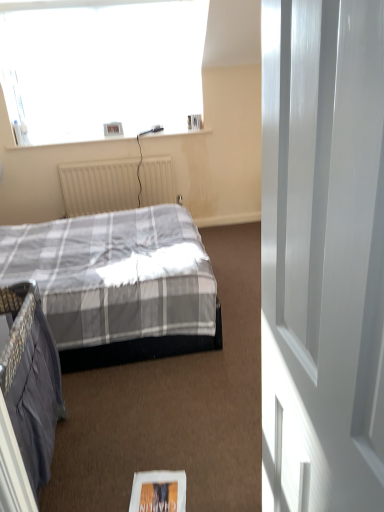
Question: Can you confirm if beige textured radiator at center is wider than white glossy door at right?

Choices:
 (A) no
 (B) yes

Answer: (B)

Question: Considering the relative positions of beige textured radiator at center and white glossy door at right in the image provided, is beige textured radiator at center to the left of white glossy door at right from the viewer's perspective?

Choices:
 (A) no
 (B) yes

Answer: (B)

Question: Does beige textured radiator at center have a smaller size compared to white glossy door at right?

Choices:
 (A) no
 (B) yes

Answer: (A)

Question: Is beige textured radiator at center positioned behind white glossy door at right?

Choices:
 (A) no
 (B) yes

Answer: (B)

Question: Is beige textured radiator at center far away from white glossy door at right?

Choices:
 (A) yes
 (B) no

Answer: (A)

Question: From the image's perspective, relative to white paper magazine at lower center, is beige textured radiator at center above or below?

Choices:
 (A) above
 (B) below

Answer: (A)

Question: In the image, is beige textured radiator at center on the left side or the right side of white paper magazine at lower center?

Choices:
 (A) left
 (B) right

Answer: (A)

Question: Is beige textured radiator at center inside the boundaries of white paper magazine at lower center, or outside?

Choices:
 (A) outside
 (B) inside

Answer: (A)

Question: Is point (99, 206) positioned closer to the camera than point (140, 509)?

Choices:
 (A) farther
 (B) closer

Answer: (A)

Question: In terms of size, does white glossy door at right appear bigger or smaller than white paper magazine at lower center?

Choices:
 (A) small
 (B) big

Answer: (B)

Question: Is point (301, 51) positioned closer to the camera than point (173, 489)?

Choices:
 (A) closer
 (B) farther

Answer: (A)

Question: Do you think white glossy door at right is within white paper magazine at lower center, or outside of it?

Choices:
 (A) outside
 (B) inside

Answer: (A)

Question: From a real-world perspective, relative to white paper magazine at lower center, is white glossy door at right vertically above or below?

Choices:
 (A) below
 (B) above

Answer: (B)

Question: From the image's perspective, relative to beige textured radiator at center, is white paper magazine at lower center above or below?

Choices:
 (A) above
 (B) below

Answer: (B)

Question: Looking at their shapes, would you say white paper magazine at lower center is wider or thinner than beige textured radiator at center?

Choices:
 (A) wide
 (B) thin

Answer: (A)